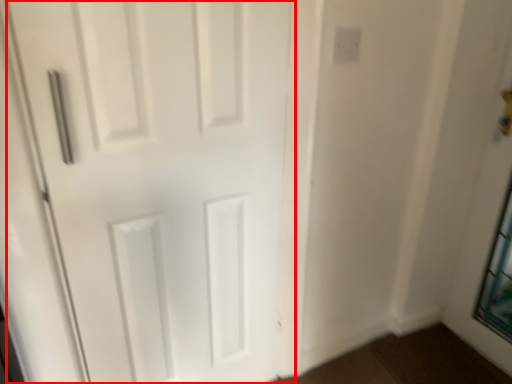
Question: In this image, where is door (annotated by the red box) located relative to electric outlet?

Choices:
 (A) left
 (B) right

Answer: (A)